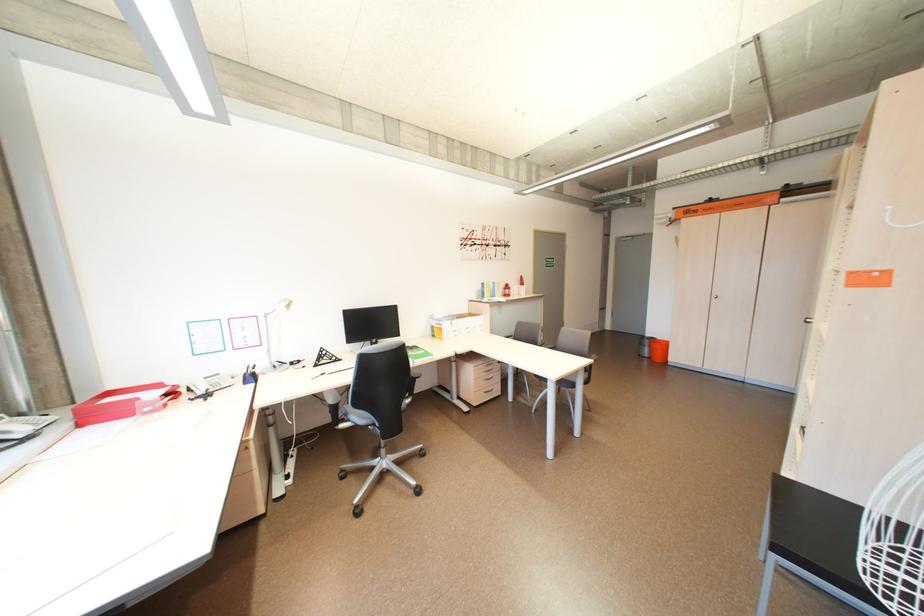
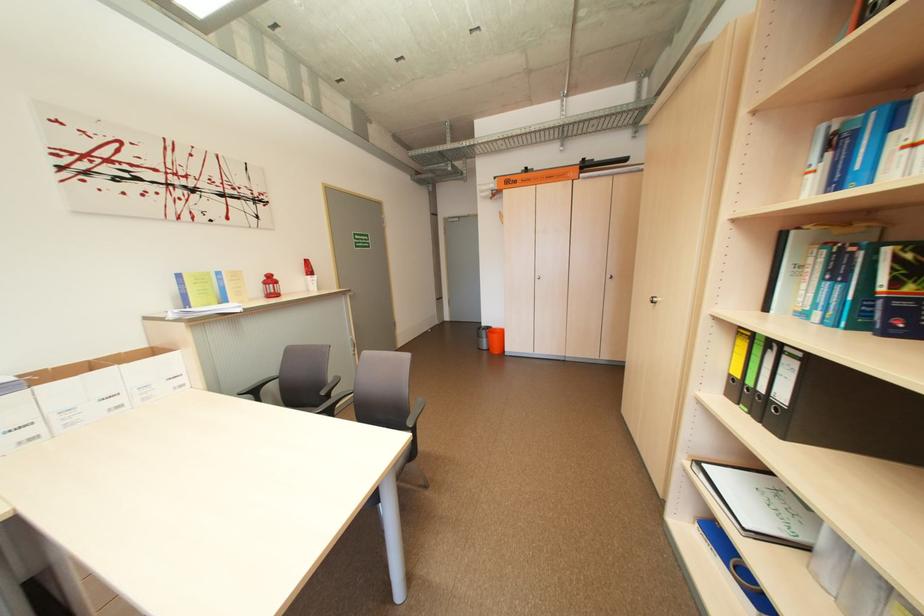
Where in the second image is the point corresponding to point (514, 290) from the first image?

(274, 284)